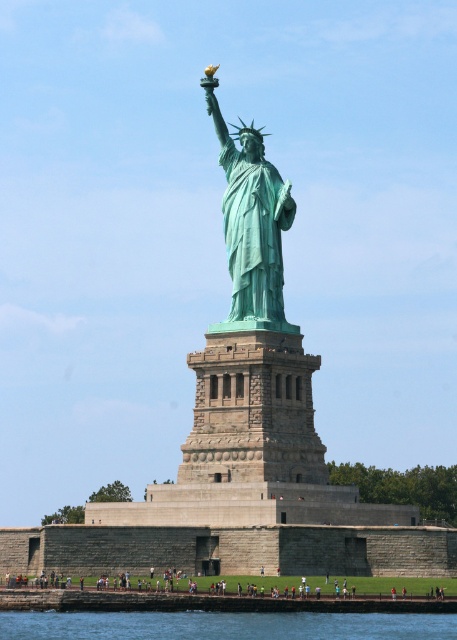
Question: In this image, where is blue water at lower center located relative to green patina statue at center?

Choices:
 (A) below
 (B) above

Answer: (A)

Question: Can you confirm if blue water at lower center is thinner than green patina statue at center?

Choices:
 (A) yes
 (B) no

Answer: (B)

Question: Which object appears farthest from the camera in this image?

Choices:
 (A) green patina statue at center
 (B) blue water at lower center

Answer: (A)

Question: Among these points, which one is nearest to the camera?

Choices:
 (A) (281, 305)
 (B) (416, 624)

Answer: (B)

Question: Does blue water at lower center lie behind green patina statue at center?

Choices:
 (A) yes
 (B) no

Answer: (B)